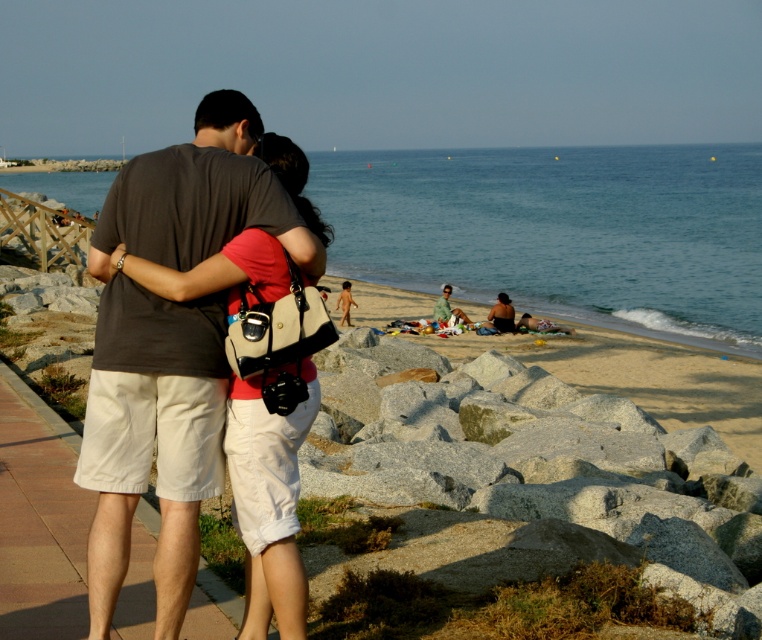
Question: Which point is closer to the camera?

Choices:
 (A) beige fabric shirt at center
 (B) blue water at center

Answer: (B)

Question: Which of the following is the farthest from the observer?

Choices:
 (A) (725, 339)
 (B) (490, 312)
 (C) (226, 205)
 (D) (450, 289)

Answer: (D)

Question: Is the position of matte black bikini at center less distant than that of beige fabric shirt at center?

Choices:
 (A) yes
 (B) no

Answer: (A)

Question: Can you confirm if dark gray t-shirt at left is smaller than beige fabric shirt at center?

Choices:
 (A) no
 (B) yes

Answer: (A)

Question: Which of the following is the closest to the observer?

Choices:
 (A) matte black bikini at center
 (B) beige fabric shirt at center
 (C) dark gray t-shirt at left

Answer: (C)

Question: Does dark gray t-shirt at left appear on the left side of beige fabric shirt at center?

Choices:
 (A) yes
 (B) no

Answer: (A)